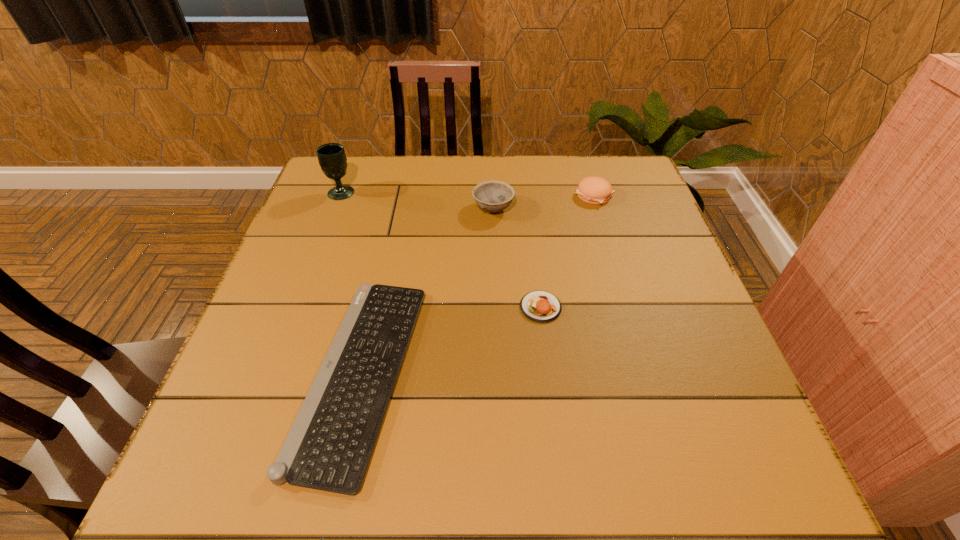
Where is `object that is at the far left corner`? Image resolution: width=960 pixels, height=540 pixels. object that is at the far left corner is located at coordinates (332, 159).

Where is `object that is positioned at the near left corner`? object that is positioned at the near left corner is located at coordinates (329, 446).

The height and width of the screenshot is (540, 960). Identify the location of object that is at the far right corner. (594, 190).

The image size is (960, 540). I want to click on blank area at the far edge, so point(472,172).

This screenshot has width=960, height=540. Identify the location of vacant space at the near edge of the desktop. (413, 465).

The width and height of the screenshot is (960, 540). I want to click on free space at the left edge of the desktop, so click(x=324, y=241).

In the image, there is a desktop. Where is `free space at the right edge`? free space at the right edge is located at coordinates (627, 267).

Image resolution: width=960 pixels, height=540 pixels. I want to click on free space at the near left corner, so click(270, 494).

The height and width of the screenshot is (540, 960). Find the location of `vacant space that is in between the third tallest object and the shorter patty (food)`. vacant space that is in between the third tallest object and the shorter patty (food) is located at coordinates (567, 251).

The width and height of the screenshot is (960, 540). I want to click on free area in between the rightmost object and the chalice, so click(x=468, y=194).